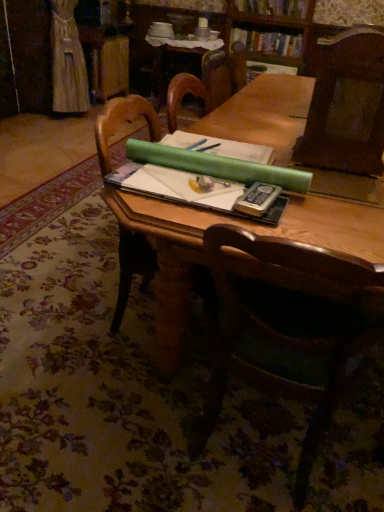
This screenshot has width=384, height=512. Find the location of `free location in front of hardcover book at center`. free location in front of hardcover book at center is located at coordinates (284, 225).